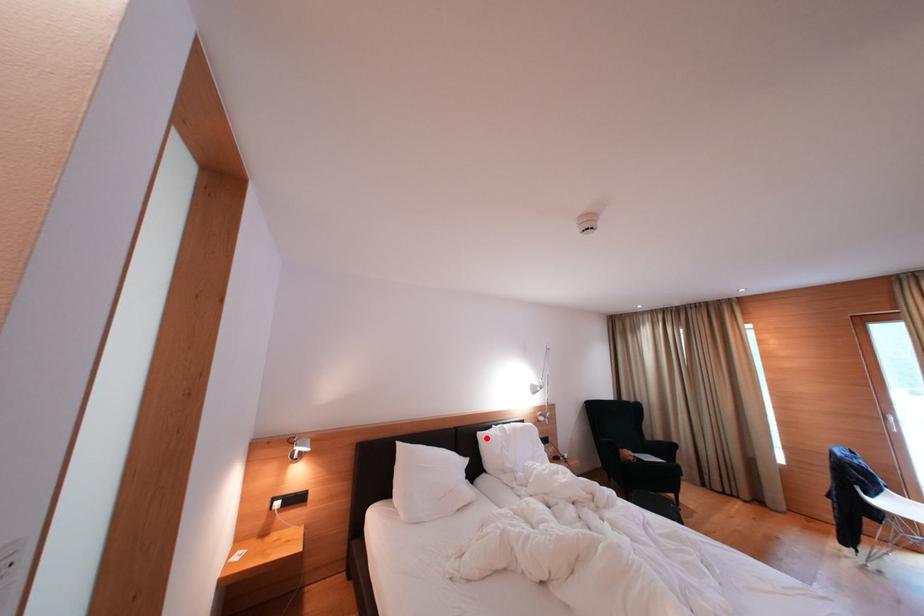
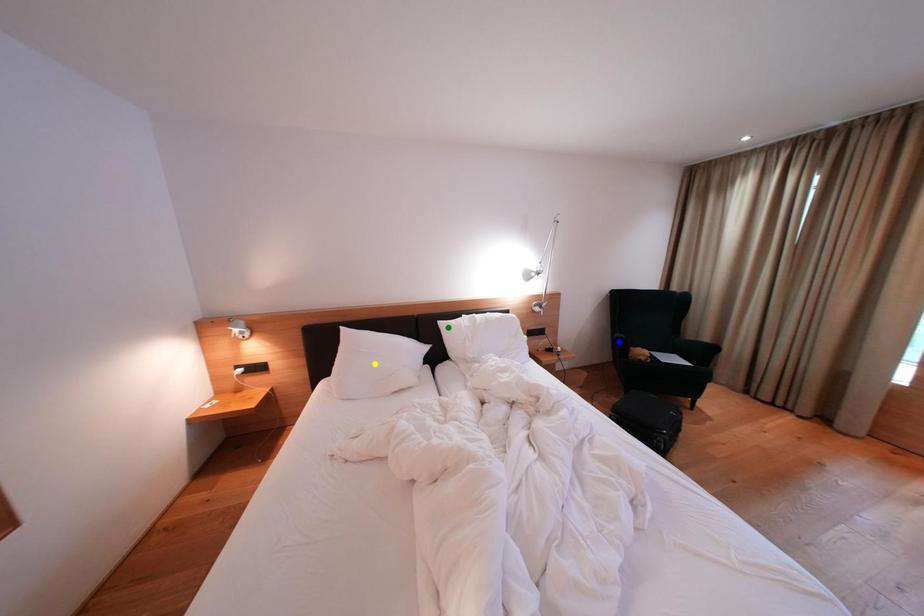
Question: I am providing you with two images of the same scene from different viewpoints. A red point is marked on the first image. You are given multiple points on the second image. Which point in image 2 is actually the same real-world point as the red point in image 1?

Choices:
 (A) blue point
 (B) green point
 (C) yellow point

Answer: (B)